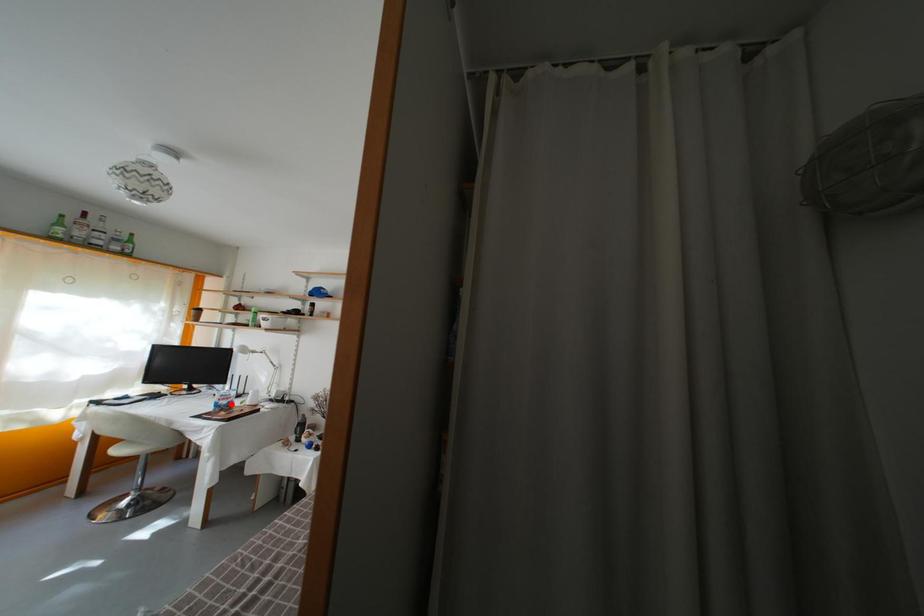
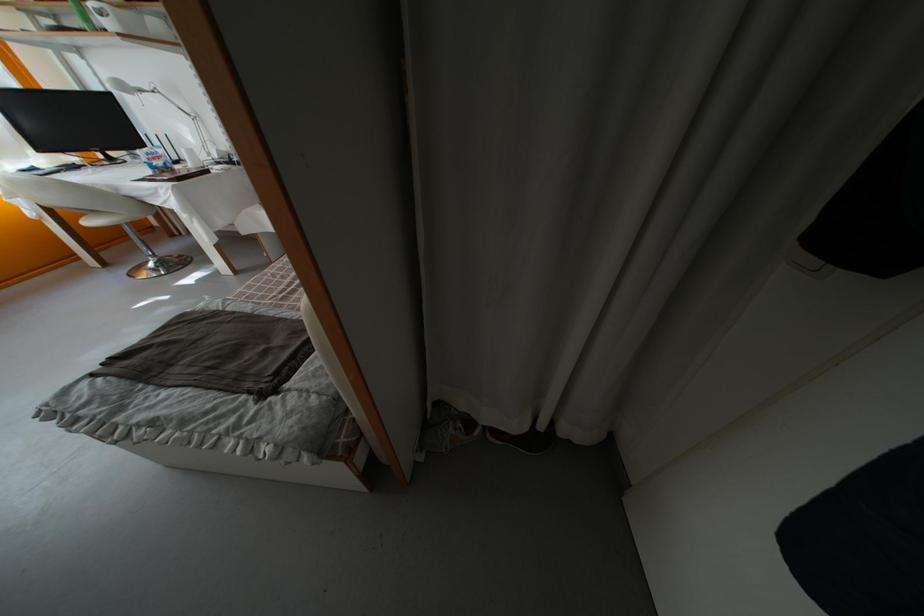
The point at the highlighted location is marked in the first image. Where is the corresponding point in the second image?

(160, 161)